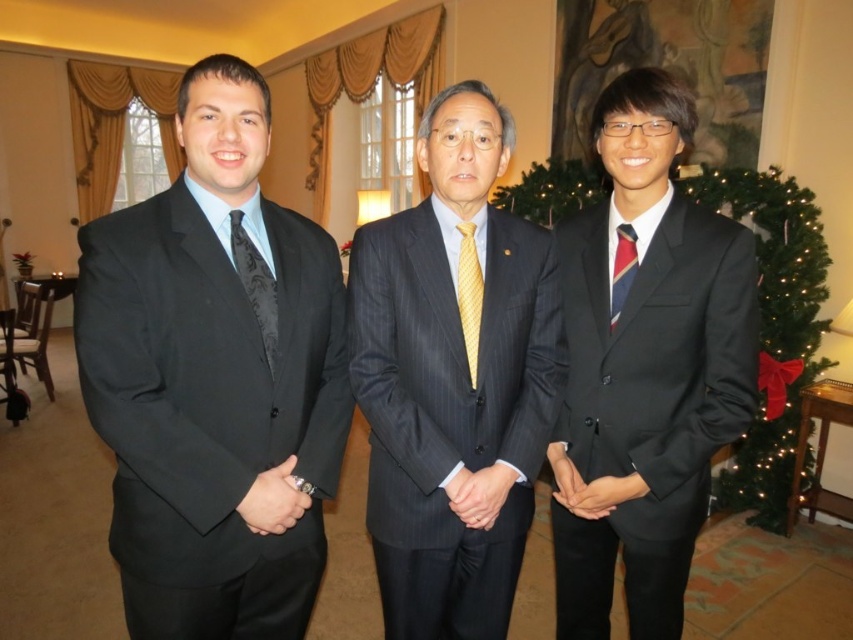
You are organizing a charity event and need to ensure that the attire of the attendees matches the theme. The theme requires that the most prominent color in the outfit should be darker than any other colors present. Based on the image, does the matte black suit at left meet this requirement compared to the yellow silk tie at center?

The matte black suit at left has a larger size compared to yellow silk tie at center, but the question is about color prominence. Since black is inherently a darker color than yellow, the matte black suit at left meets the theme requirement as its primary color is darker than the yellow silk tie at center.